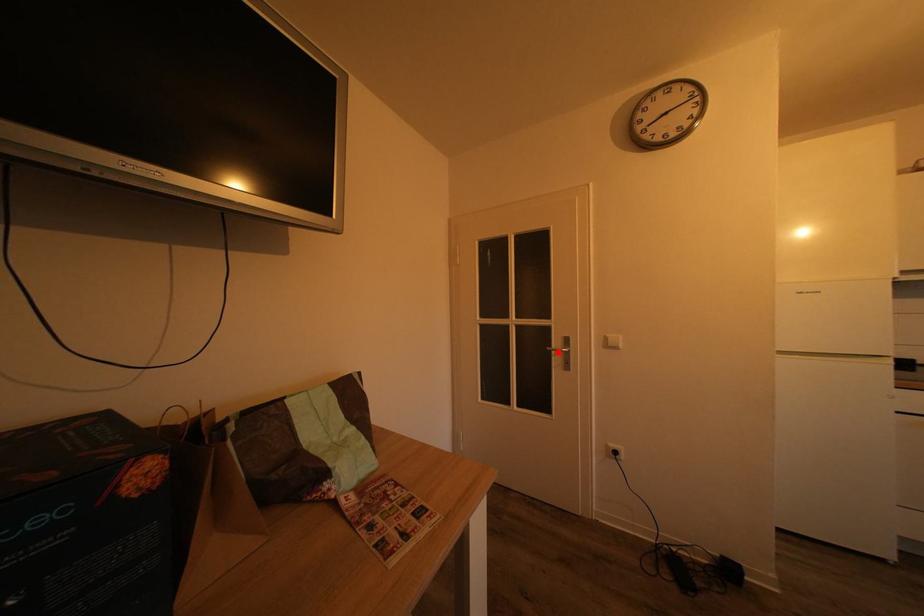
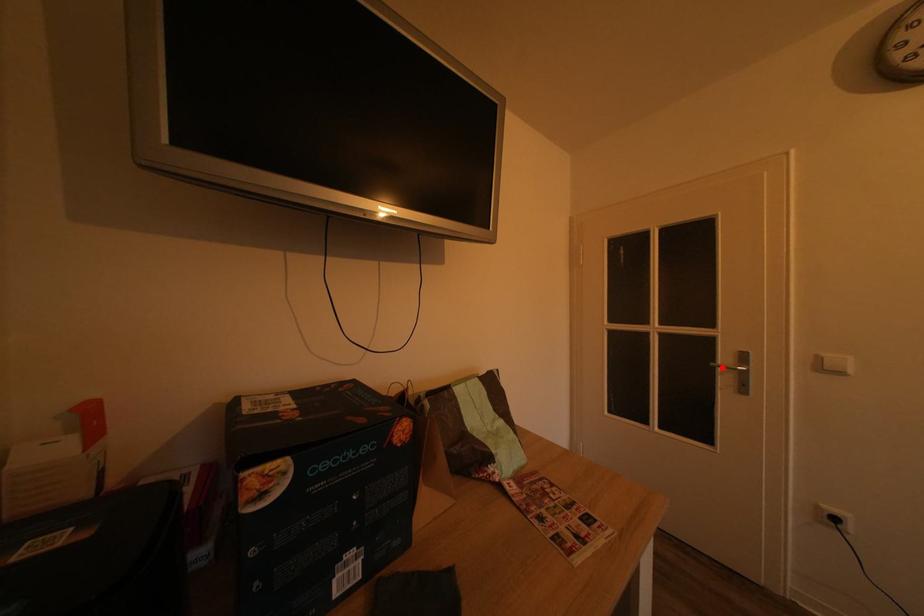
I am providing you with two images of the same scene from different viewpoints. A red point is marked on the first image and another point is marked on the second image. Is the marked point in image1 the same physical position as the marked point in image2?

Yes